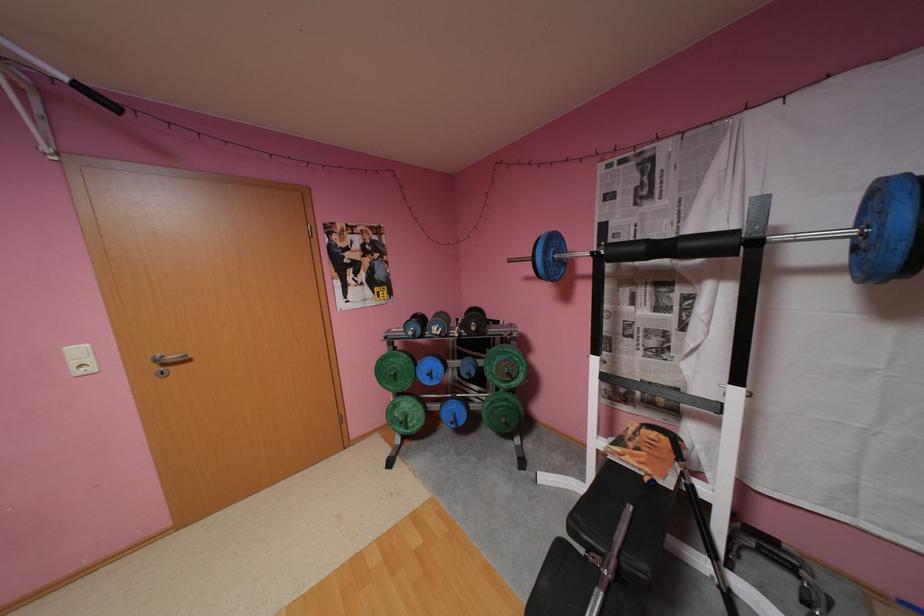
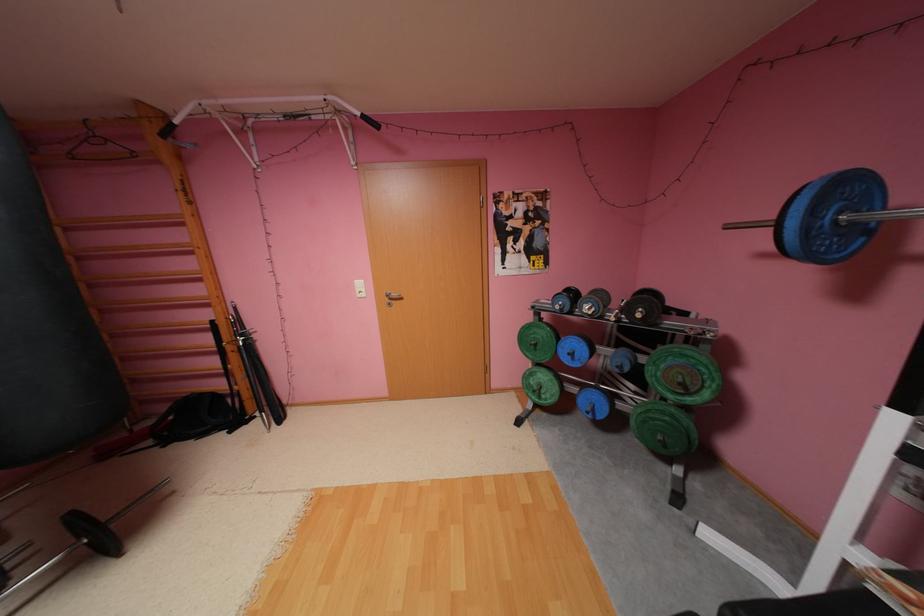
Where in the second image is the point corresponding to (553,262) from the first image?

(816, 229)